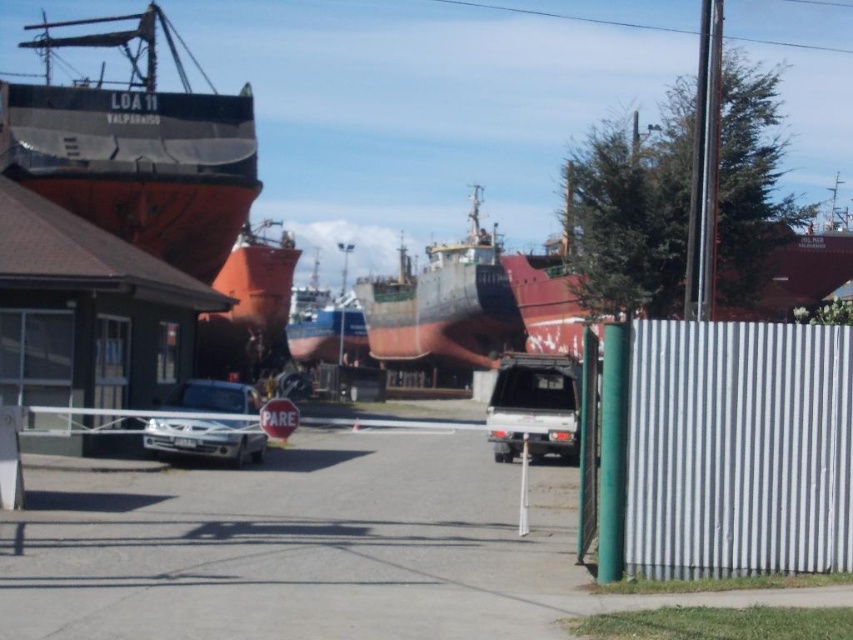
Question: Is the position of satin silver truck at center less distant than that of white matte stop sign at center?

Choices:
 (A) no
 (B) yes

Answer: (A)

Question: Does silver metallic sedan at center come in front of blue metallic boat at center?

Choices:
 (A) yes
 (B) no

Answer: (A)

Question: Which point appears farthest from the camera in this image?

Choices:
 (A) (248, 376)
 (B) (650, 353)
 (C) (21, 128)
 (D) (556, 444)

Answer: (A)

Question: Which point is farther to the camera?

Choices:
 (A) (531, 276)
 (B) (498, 292)
 (C) (338, 333)
 (D) (149, 445)

Answer: (C)

Question: Is silver corrugated fence at right further to camera compared to blue metallic boat at center?

Choices:
 (A) no
 (B) yes

Answer: (A)

Question: Estimate the real-world distances between objects in this image. Which object is farther from the white matte stop sign at center?

Choices:
 (A) rusty metal ship at upper right
 (B) silver corrugated fence at right
 (C) rusty metal ship at center

Answer: (C)